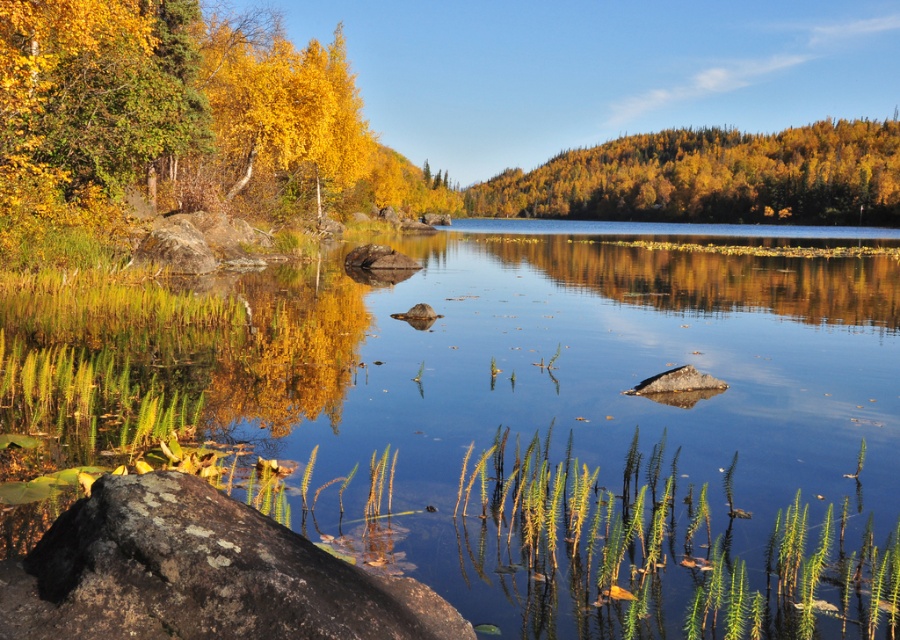
Question: Which point is closer to the camera taking this photo?

Choices:
 (A) (325, 611)
 (B) (817, 516)

Answer: (A)

Question: Is rusty stone at lower left positioned before golden textured hillside at upper right?

Choices:
 (A) yes
 (B) no

Answer: (A)

Question: Observing the image, what is the correct spatial positioning of clear water at center in reference to golden textured hillside at upper right?

Choices:
 (A) above
 (B) below

Answer: (B)

Question: Among these objects, which one is nearest to the camera?

Choices:
 (A) clear water at center
 (B) golden textured hillside at upper right

Answer: (A)

Question: Which object is farther from the camera taking this photo?

Choices:
 (A) clear water at center
 (B) golden textured hillside at upper right
 (C) rusty stone at lower left

Answer: (B)

Question: Is clear water at center thinner than golden textured hillside at upper right?

Choices:
 (A) no
 (B) yes

Answer: (B)